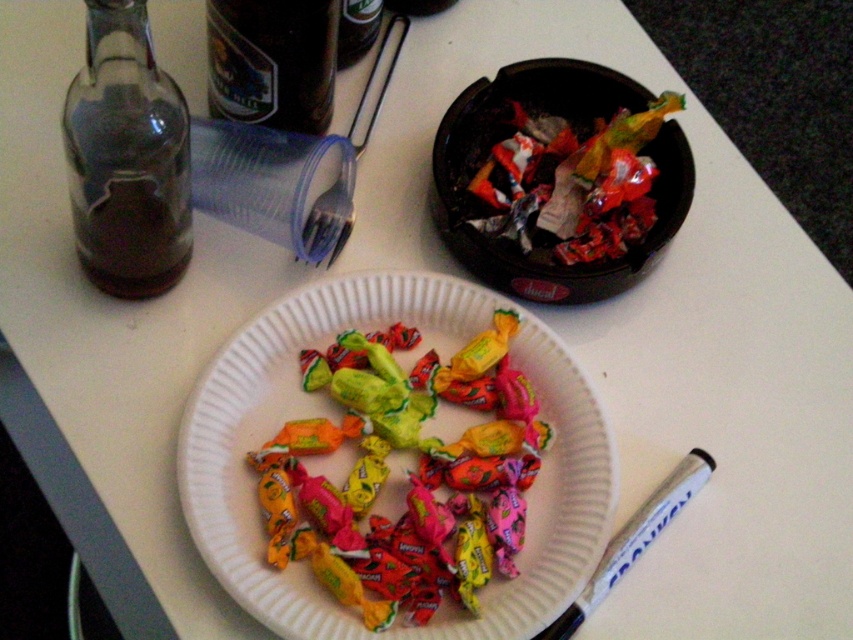
Is transparent glass bottle at left positioned behind white glossy marker at lower right?

That is False.

Between transparent glass bottle at left and white glossy marker at lower right, which one appears on the left side from the viewer's perspective?

transparent glass bottle at left is more to the left.

What do you see at coordinates (126, 157) in the screenshot?
I see `transparent glass bottle at left` at bounding box center [126, 157].

At what (x,y) coordinates should I click in order to perform the action: click on transparent glass bottle at left. Please return your answer as a coordinate pair (x, y). The height and width of the screenshot is (640, 853). Looking at the image, I should click on (126, 157).

Who is taller, glossy paper plate at center or shiny metallic foil at upper right?

glossy paper plate at center

Between point (300, 317) and point (547, 148), which one is positioned in front?

Point (300, 317) is in front.

Identify the location of glossy paper plate at center. The image size is (853, 640). (421, 330).

Between brown glass bottle at upper left and white glossy marker at lower right, which one is positioned higher?

Positioned higher is brown glass bottle at upper left.

Can you confirm if brown glass bottle at upper left is bigger than white glossy marker at lower right?

Incorrect, brown glass bottle at upper left is not larger than white glossy marker at lower right.

Does point (218, 108) come farther from viewer compared to point (657, 504)?

Yes, it is behind point (657, 504).

Image resolution: width=853 pixels, height=640 pixels. Identify the location of brown glass bottle at upper left. (271, 61).